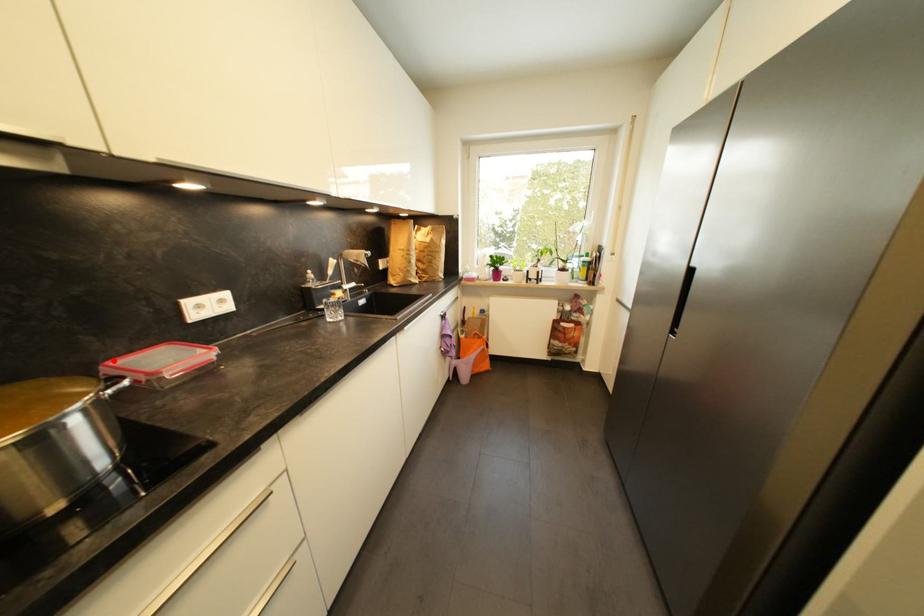
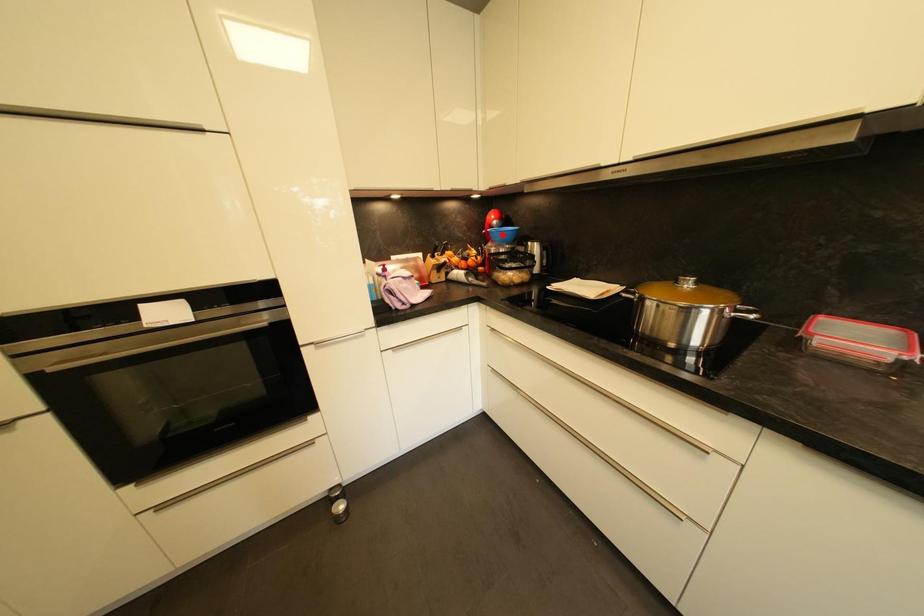
I am providing you with two images of the same scene from different viewpoints. A red point is marked on the first image and another point is marked on the second image. Is the red point in image1 aligned with the point shown in image2?

No